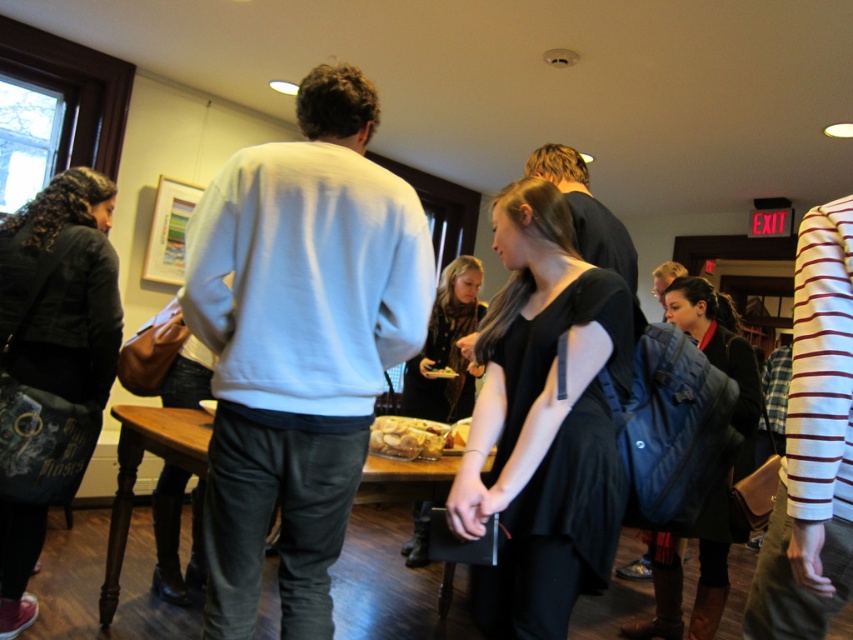
Question: Based on their relative distances, which object is nearer to the wooden table at center?

Choices:
 (A) black matte dress at center
 (B) dark green fabric jacket at left

Answer: (B)

Question: Does white striped shirt at right appear over wooden table at center?

Choices:
 (A) yes
 (B) no

Answer: (A)

Question: Considering the relative positions of white matte sweatshirt at center and golden brown bread at center in the image provided, where is white matte sweatshirt at center located with respect to golden brown bread at center?

Choices:
 (A) below
 (B) above

Answer: (B)

Question: Is black matte dress at center bigger than wooden table at center?

Choices:
 (A) no
 (B) yes

Answer: (A)

Question: Which point appears closest to the camera in this image?

Choices:
 (A) (527, 349)
 (B) (376, 444)
 (C) (33, 608)

Answer: (A)

Question: Among these points, which one is farthest from the camera?

Choices:
 (A) (381, 497)
 (B) (270, 484)

Answer: (A)